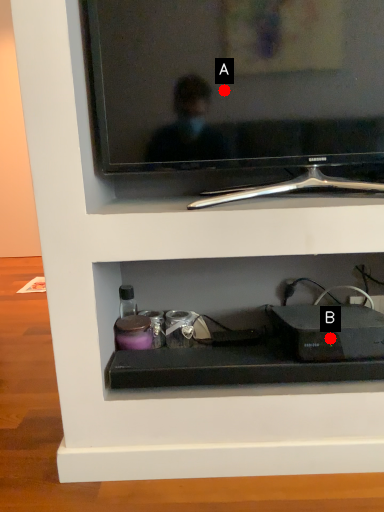
Question: Two points are circled on the image, labeled by A and B beside each circle. Which point is closer to the camera?

Choices:
 (A) A is closer
 (B) B is closer

Answer: (A)